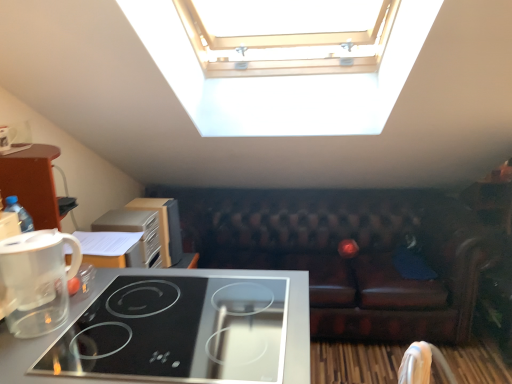
Image resolution: width=512 pixels, height=384 pixels. I want to click on free space above wooden cabinet at left, marked as the first appliance in a back-to-front arrangement (from a real-world perspective), so click(147, 201).